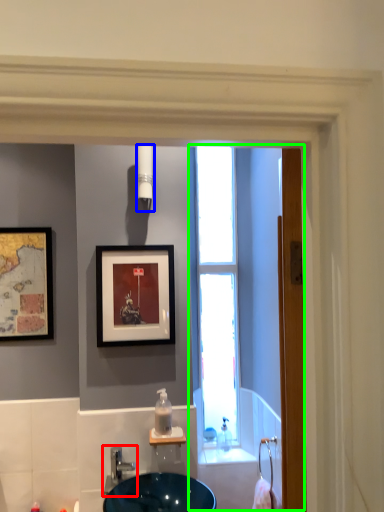
Question: Which object is the farthest from tap (highlighted by a red box)? Choose among these: light fixture (highlighted by a blue box) or screen door (highlighted by a green box).

Choices:
 (A) light fixture
 (B) screen door

Answer: (A)